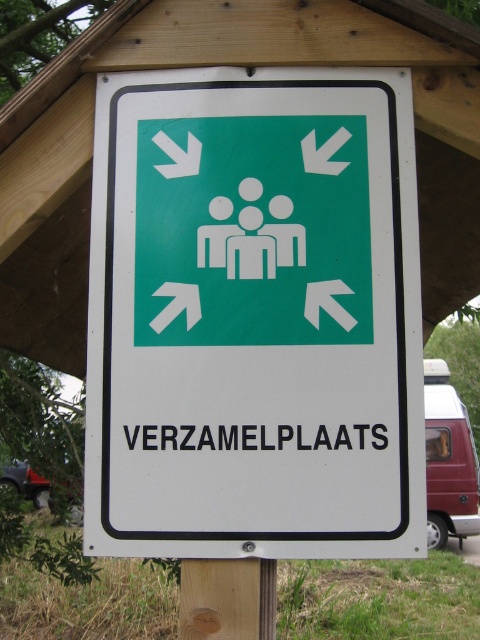
Question: Which of the following is the farthest from the observer?

Choices:
 (A) green plastic sign at center
 (B) wooden post at center

Answer: (B)

Question: Can you confirm if green plastic sign at center is wider than wooden post at center?

Choices:
 (A) yes
 (B) no

Answer: (A)

Question: Does green plastic sign at center have a lesser width compared to wooden post at center?

Choices:
 (A) no
 (B) yes

Answer: (A)

Question: Where is green plastic sign at center located in relation to wooden post at center in the image?

Choices:
 (A) below
 (B) above

Answer: (B)

Question: Which object appears closest to the camera in this image?

Choices:
 (A) green plastic sign at center
 (B) wooden post at center

Answer: (A)

Question: Which of the following is the farthest from the observer?

Choices:
 (A) wooden post at center
 (B) green plastic sign at center

Answer: (A)